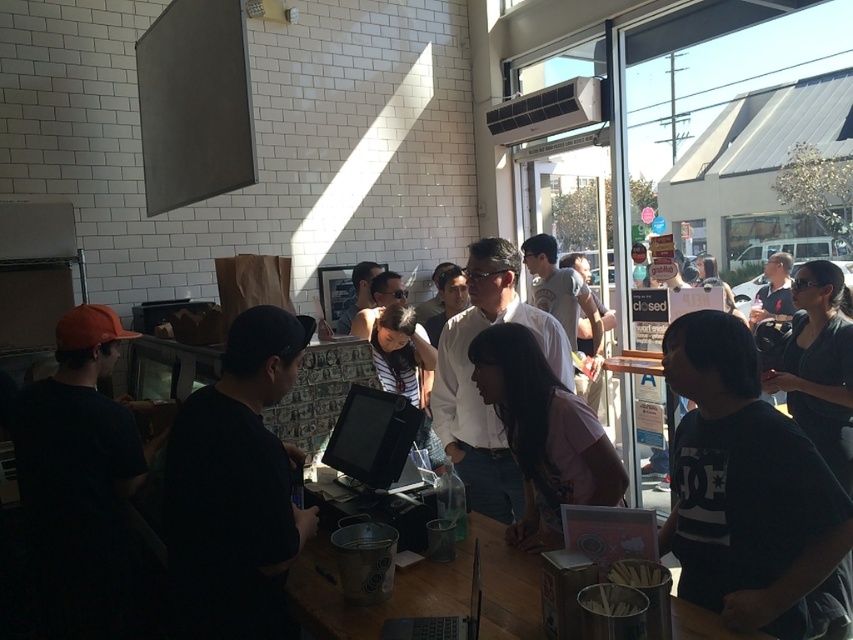
Question: Is pink fabric shirt at center positioned before wooden table at center?

Choices:
 (A) yes
 (B) no

Answer: (B)

Question: Does black cotton t-shirt at right appear on the right side of pink fabric shirt at center?

Choices:
 (A) no
 (B) yes

Answer: (B)

Question: Which object is farther from the camera taking this photo?

Choices:
 (A) black cotton t-shirt at right
 (B) wooden table at center

Answer: (B)

Question: Which of the following is the closest to the observer?

Choices:
 (A) pink fabric shirt at center
 (B) wooden table at center

Answer: (B)

Question: Is black cotton t-shirt at right positioned in front of pink fabric shirt at center?

Choices:
 (A) no
 (B) yes

Answer: (B)

Question: Among these points, which one is farthest from the camera?

Choices:
 (A) (675, 442)
 (B) (328, 547)

Answer: (B)